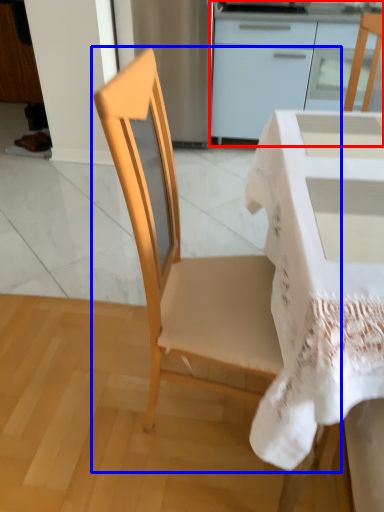
Question: Which object appears closest to the camera in this image, cabinetry (highlighted by a red box) or chair (highlighted by a blue box)?

Choices:
 (A) cabinetry
 (B) chair

Answer: (B)